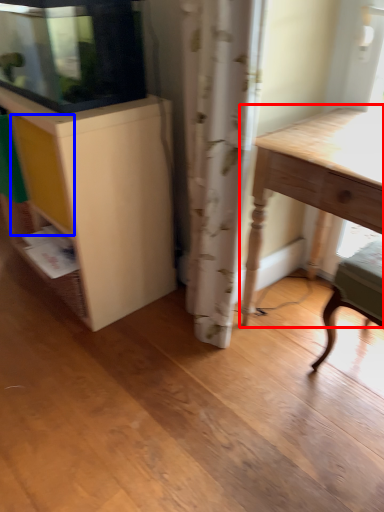
Question: Among these objects, which one is farthest to the camera, table (highlighted by a red box) or drawer (highlighted by a blue box)?

Choices:
 (A) table
 (B) drawer

Answer: (B)